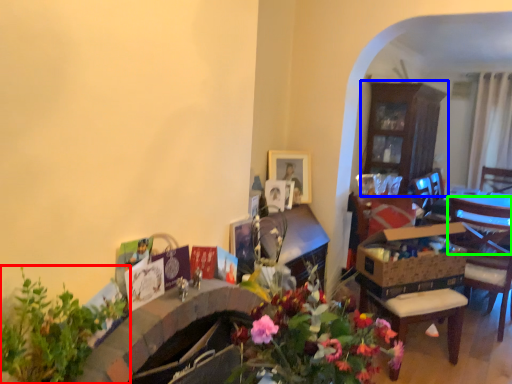
Question: Estimate the real-world distances between objects in this image. Which object is closer to houseplant (highlighted by a red box), cabinetry (highlighted by a blue box) or chair (highlighted by a green box)?

Choices:
 (A) cabinetry
 (B) chair

Answer: (B)